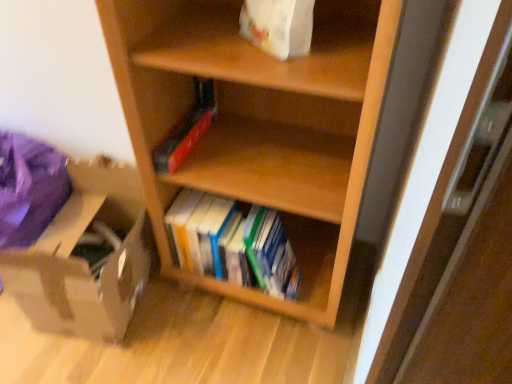
Where is `free space in front of brown cardboard box at lower left`? This screenshot has width=512, height=384. free space in front of brown cardboard box at lower left is located at coordinates (93, 358).